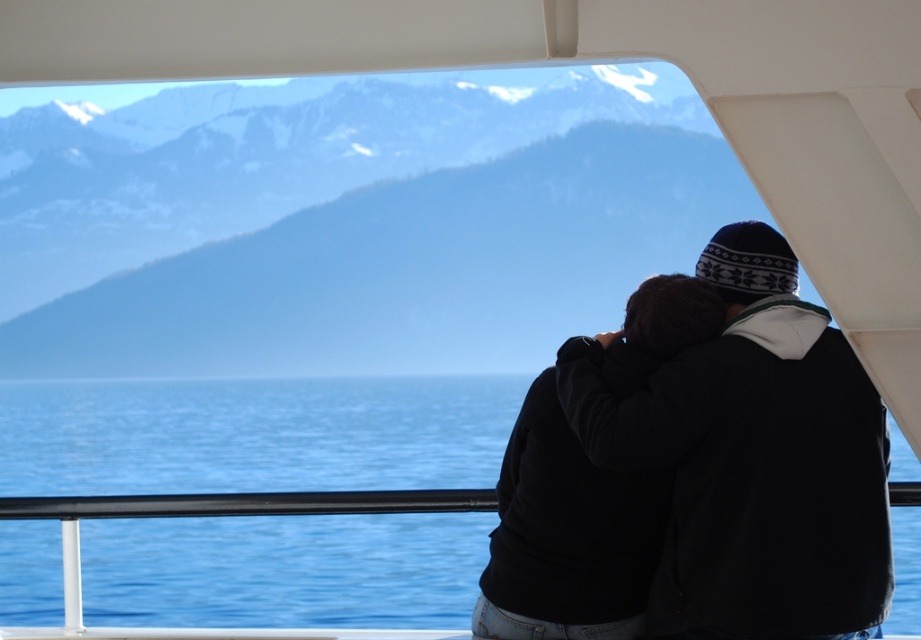
Is blue water at center thinner than black fleece jacket at center?

In fact, blue water at center might be wider than black fleece jacket at center.

Is blue water at center positioned at the back of black fleece jacket at center?

Yes.

Who is more distant from viewer, (102,616) or (834,396)?

The point (102,616) is more distant.

I want to click on blue water at center, so click(x=254, y=435).

This screenshot has width=921, height=640. Find the location of `snowy mountain range at upper left`. snowy mountain range at upper left is located at coordinates [360, 230].

Does snowy mountain range at upper left have a lesser width compared to black fleece jacket at center?

No, snowy mountain range at upper left is not thinner than black fleece jacket at center.

Who is more forward, (138, 282) or (742, 582)?

Point (742, 582)

Find the location of a particular element. The height and width of the screenshot is (640, 921). snowy mountain range at upper left is located at coordinates (360, 230).

This screenshot has width=921, height=640. I want to click on snowy mountain range at upper left, so click(360, 230).

Is snowy mountain range at upper left closer to the viewer compared to blue water at center?

Yes, snowy mountain range at upper left is closer to the viewer.

Which is in front, point (35, 278) or point (896, 515)?

Point (896, 515)

Find the location of `snowy mountain range at upper left`. snowy mountain range at upper left is located at coordinates (360, 230).